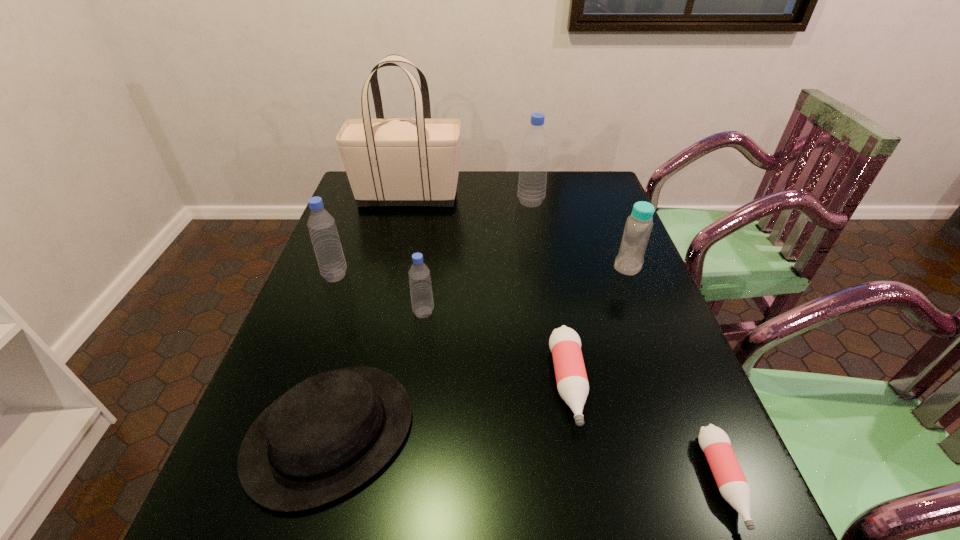
Where is `free space located 0.400m on the back of the black fedora`? This screenshot has width=960, height=540. free space located 0.400m on the back of the black fedora is located at coordinates (379, 258).

You are a GUI agent. You are given a task and a screenshot of the screen. Output one action in this format:
    pyautogui.click(x=<x>, y=<y>)
    Task: Click on the vacant space located with the cap open on the fifth tallest bottle
    
    Given the screenshot: What is the action you would take?
    pyautogui.click(x=592, y=517)

Locate an element on the screen. This screenshot has height=540, width=960. shopping bag at the far edge is located at coordinates (398, 161).

This screenshot has width=960, height=540. I want to click on bottle that is at the far edge, so click(531, 192).

Find the location of a particular element. fedora that is positioned at the near edge is located at coordinates pos(326,436).

Find the location of a particular element. This screenshot has height=540, width=960. bottle that is at the near edge is located at coordinates (714, 442).

You are a GUI agent. You are given a task and a screenshot of the screen. Output one action in this format:
    pyautogui.click(x=<x>, y=<y>)
    Task: Click on the shopping bag at the left edge
    
    Given the screenshot: What is the action you would take?
    pyautogui.click(x=398, y=161)

The image size is (960, 540). What are the coordinates of `bottle that is positioned at the left edge` in the screenshot? It's located at (322, 228).

Find the location of a particular element. This screenshot has width=960, height=540. fedora located in the left edge section of the desktop is located at coordinates (326, 436).

You are a GUI agent. You are given a task and a screenshot of the screen. Output one action in this format:
    pyautogui.click(x=<x>, y=<y>)
    Task: Click on the object that is at the far left corner
    Image resolution: width=960 pixels, height=540 pixels.
    Given the screenshot: What is the action you would take?
    pyautogui.click(x=398, y=161)